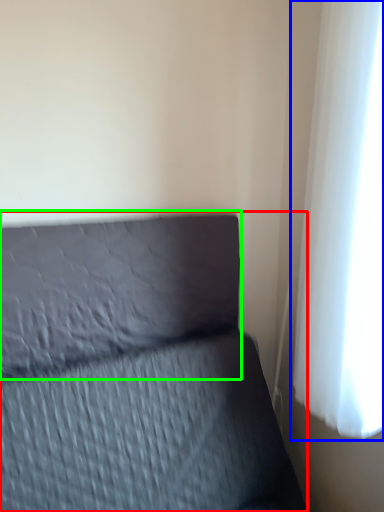
Question: Which object is the farthest from furniture (highlighted by a red box)? Choose among these: curtain (highlighted by a blue box) or pillow (highlighted by a green box).

Choices:
 (A) curtain
 (B) pillow

Answer: (A)